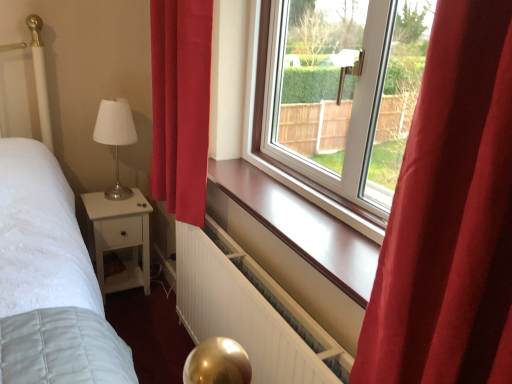
Locate an element on the screen. vacant region in front of white satin table lamp at left is located at coordinates (102, 202).